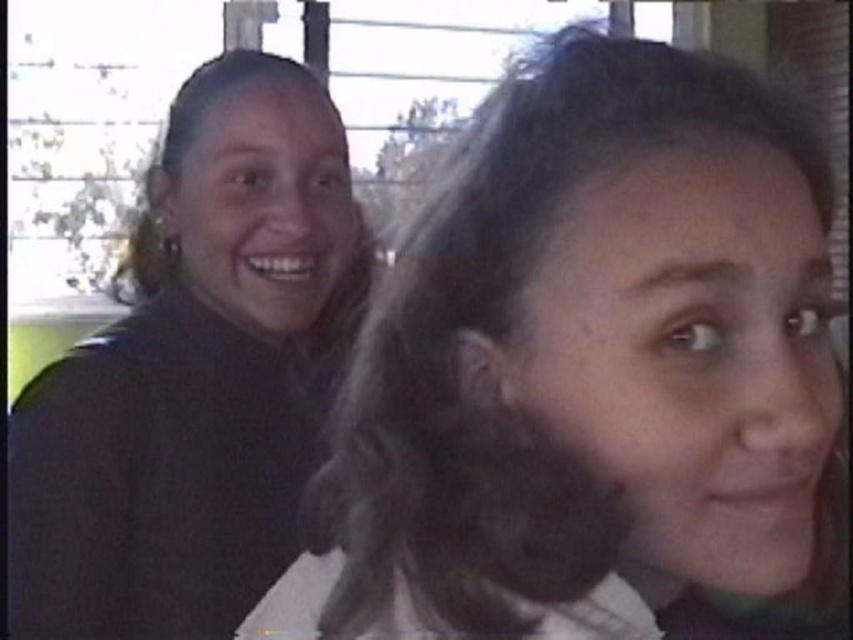
Is dark brown hair at upper center wider than matte black jacket at left?

Correct, the width of dark brown hair at upper center exceeds that of matte black jacket at left.

Is dark brown hair at upper center shorter than matte black jacket at left?

Yes.

I want to click on dark brown hair at upper center, so click(592, 374).